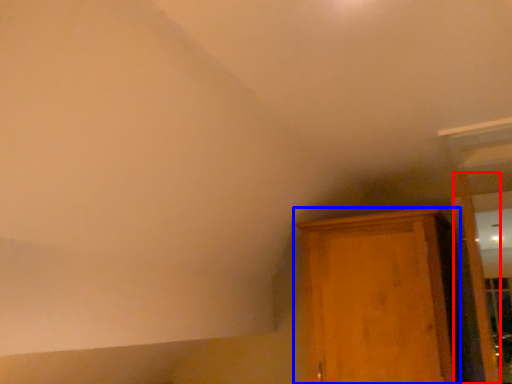
Question: Which object appears farthest to the camera in this image, door (highlighted by a red box) or cupboard (highlighted by a blue box)?

Choices:
 (A) door
 (B) cupboard

Answer: (B)